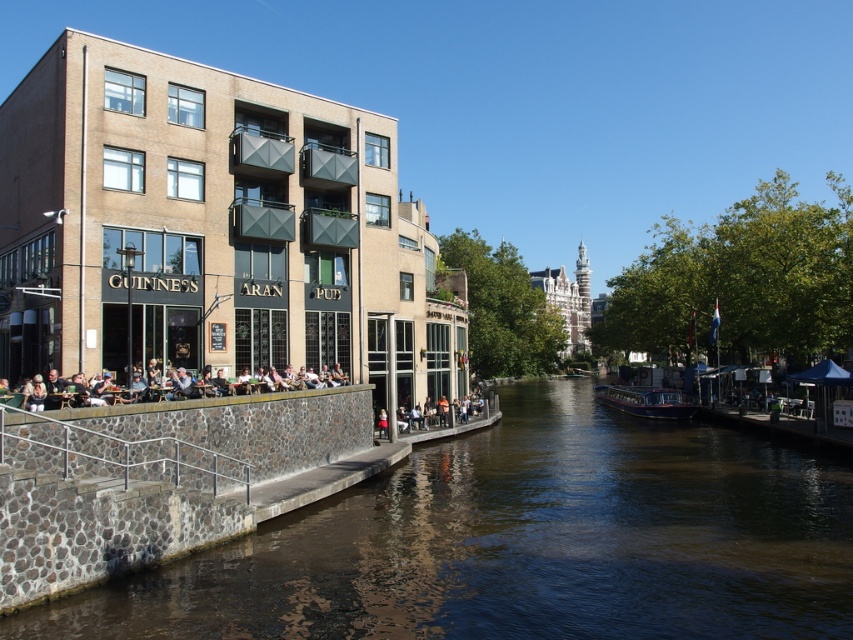
Is brown stone river at center to the right of stainless steel railing at lower left from the viewer's perspective?

Yes, brown stone river at center is to the right of stainless steel railing at lower left.

Does brown stone river at center have a lesser height compared to stainless steel railing at lower left?

Indeed, brown stone river at center has a lesser height compared to stainless steel railing at lower left.

Is point (529, 381) positioned behind point (202, 467)?

Yes, it is.

Where is `brown stone river at center`? The image size is (853, 640). brown stone river at center is located at coordinates (521, 541).

Does stainless steel railing at lower left appear on the right side of matte black chairs at left?

No, stainless steel railing at lower left is not to the right of matte black chairs at left.

From the picture: Can you confirm if stainless steel railing at lower left is positioned to the left of matte black chairs at left?

Indeed, stainless steel railing at lower left is positioned on the left side of matte black chairs at left.

Find the location of a particular element. This screenshot has height=640, width=853. stainless steel railing at lower left is located at coordinates (114, 454).

Which is below, matte black chairs at left or dark blue polished wood boat at center?

dark blue polished wood boat at center is below.

Which is behind, point (138, 400) or point (662, 417)?

Positioned behind is point (662, 417).

This screenshot has height=640, width=853. Describe the element at coordinates (103, 397) in the screenshot. I see `matte black chairs at left` at that location.

Find the location of a particular element. matte black chairs at left is located at coordinates (103, 397).